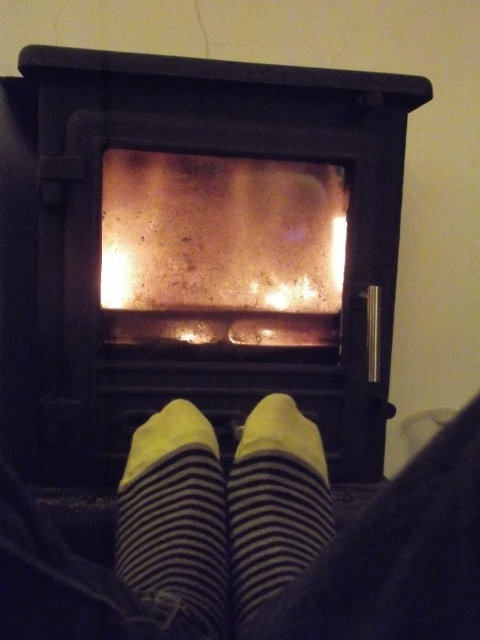
You are trying to determine if the black matte fireplace at center can completely cover the yellow striped sock at center if placed directly over it. Based on their sizes, is this possible?

The black matte fireplace at center is larger than the yellow striped sock at center, so yes, it can completely cover the yellow striped sock at center when placed directly over it.

You are standing in front of the wood burning stove and see the yellow striped sock at center. If you want to place a small gift exactly where the sock is, where should you put it in terms of coordinates?

You should place the small gift at coordinates point (176, 520) where the yellow striped sock at center is located.